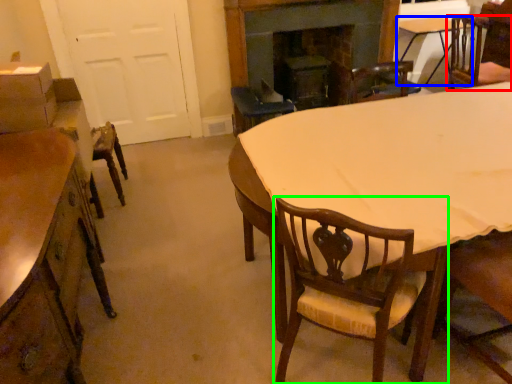
Question: Which object is positioned farthest from chair (highlighted by a red box)? Select from table (highlighted by a blue box) and chair (highlighted by a green box).

Choices:
 (A) table
 (B) chair

Answer: (B)